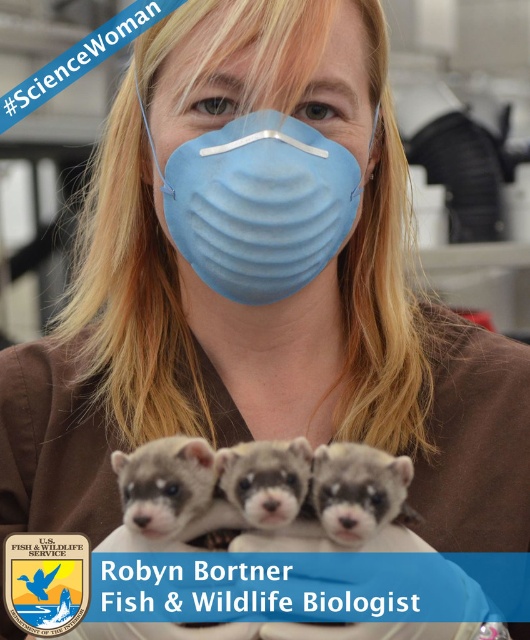
In the image of Robyn Bortner holding ferrets, which ferret is on top, the fuzzy gray ferret at center or the fuzzy white ferret at center?

The fuzzy white ferret at center is on top of the fuzzy gray ferret at center.

Looking at the image of Robyn Bortner holding two ferrets, the fuzzy gray ferret at center and the fuzzy white ferret at center, which one has a greater width?

The fuzzy gray ferret at center might be wider than the fuzzy white ferret at center according to the description provided.